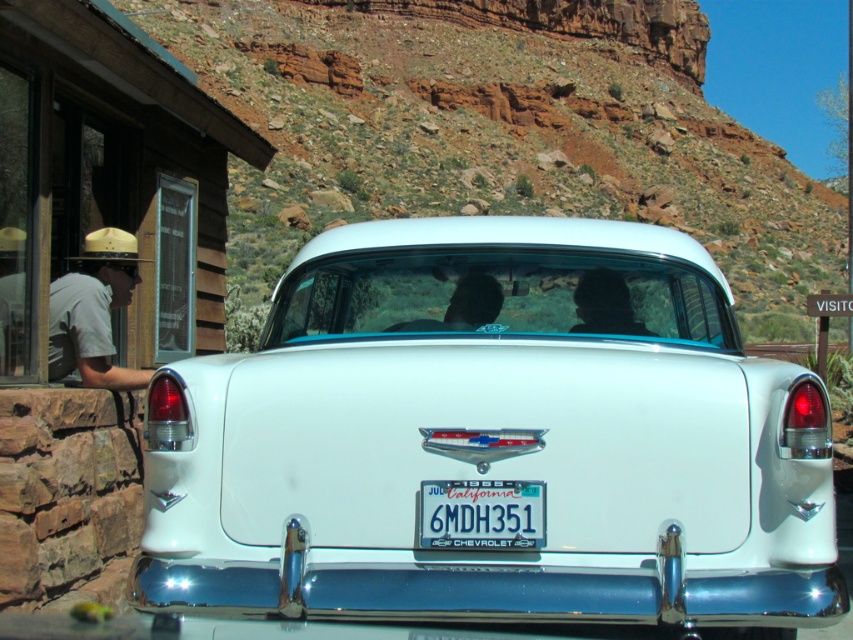
Question: Which of the following is the closest to the observer?

Choices:
 (A) (190, 358)
 (B) (451, 502)

Answer: (B)

Question: Can you confirm if white glossy car at center is positioned below white plastic license plate at center?

Choices:
 (A) yes
 (B) no

Answer: (B)

Question: Which point appears closest to the camera in this image?

Choices:
 (A) (689, 605)
 (B) (511, 230)

Answer: (A)

Question: Estimate the real-world distances between objects in this image. Which object is closer to the white glossy car at center?

Choices:
 (A) white plastic license plate at center
 (B) chrome/metallic bumper at center
 (C) matte khaki hat at left

Answer: (A)

Question: Where is white glossy car at center located in relation to chrome/metallic bumper at center in the image?

Choices:
 (A) below
 (B) above

Answer: (B)

Question: Does matte khaki hat at left have a smaller size compared to white plastic license plate at center?

Choices:
 (A) no
 (B) yes

Answer: (A)